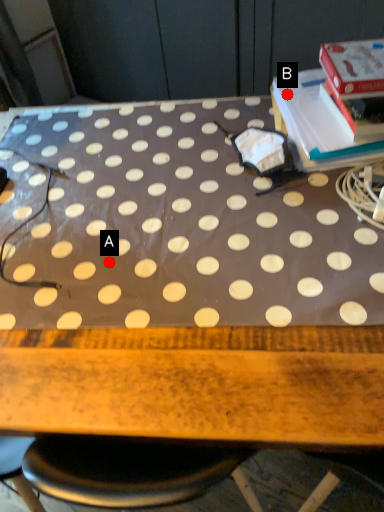
Question: Two points are circled on the image, labeled by A and B beside each circle. Among these points, which one is nearest to the camera?

Choices:
 (A) A is closer
 (B) B is closer

Answer: (A)